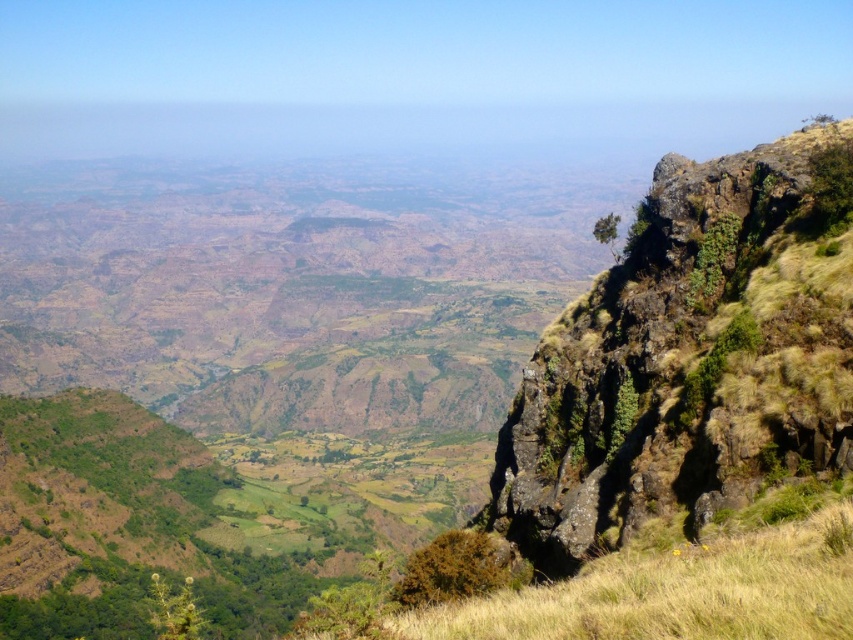
Is the position of yellow grassy at right more distant than that of green leafy bush at lower right?

No, it is not.

Who is positioned more to the left, yellow grassy at right or green leafy bush at lower right?

green leafy bush at lower right

Find the location of a particular element. The image size is (853, 640). yellow grassy at right is located at coordinates (683, 582).